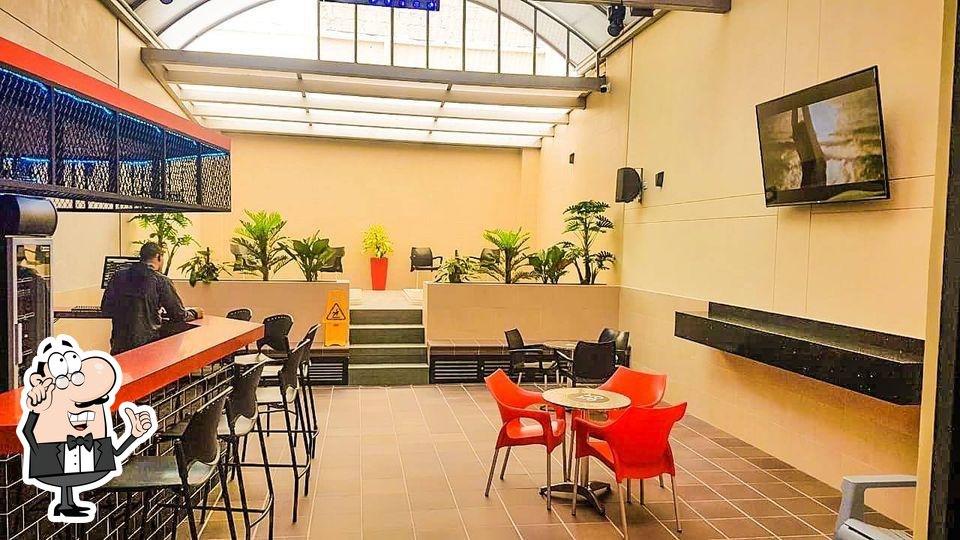
This screenshot has width=960, height=540. I want to click on gray chair seat, so click(x=864, y=529).